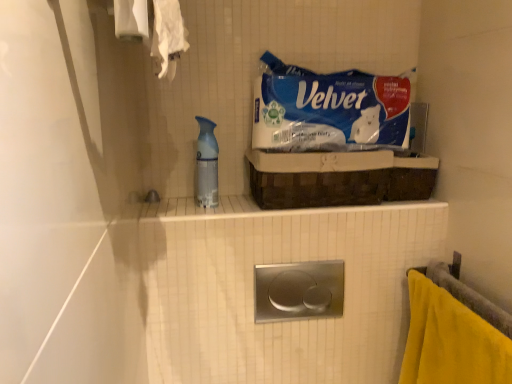
What are the coordinates of `vacant region above brown woven basket at upper center (from a real-world perspective)` in the screenshot? It's located at (339, 147).